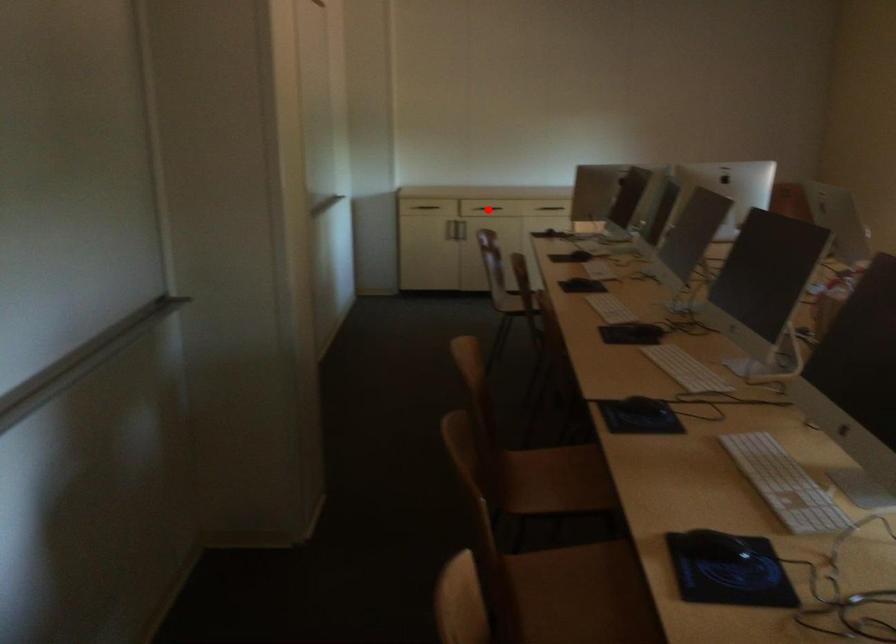
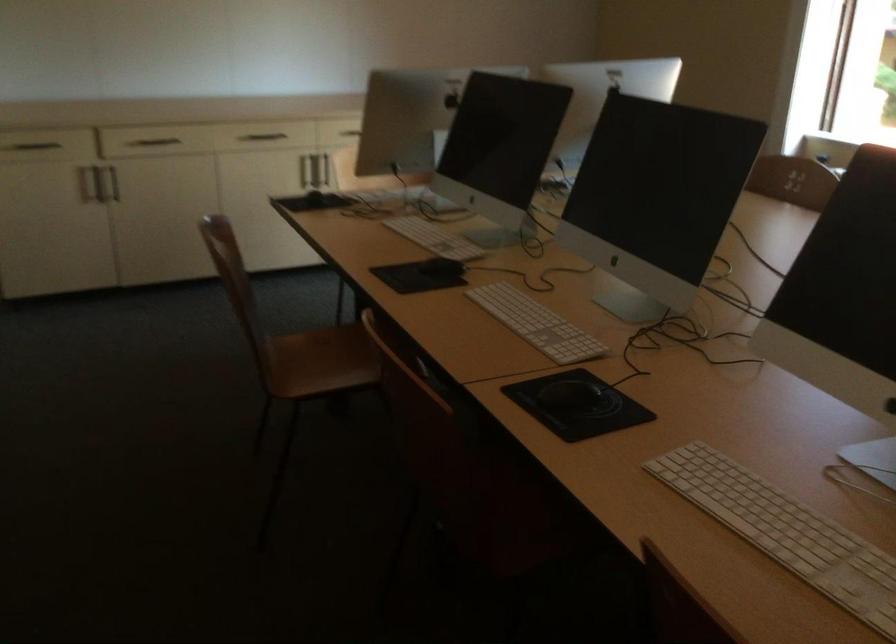
Question: I am providing you with two images of the same scene from different viewpoints. A red point is marked on the first image. At the location where the point appears in image 1, is it still visible in image 2?

Choices:
 (A) Yes
 (B) No

Answer: (B)